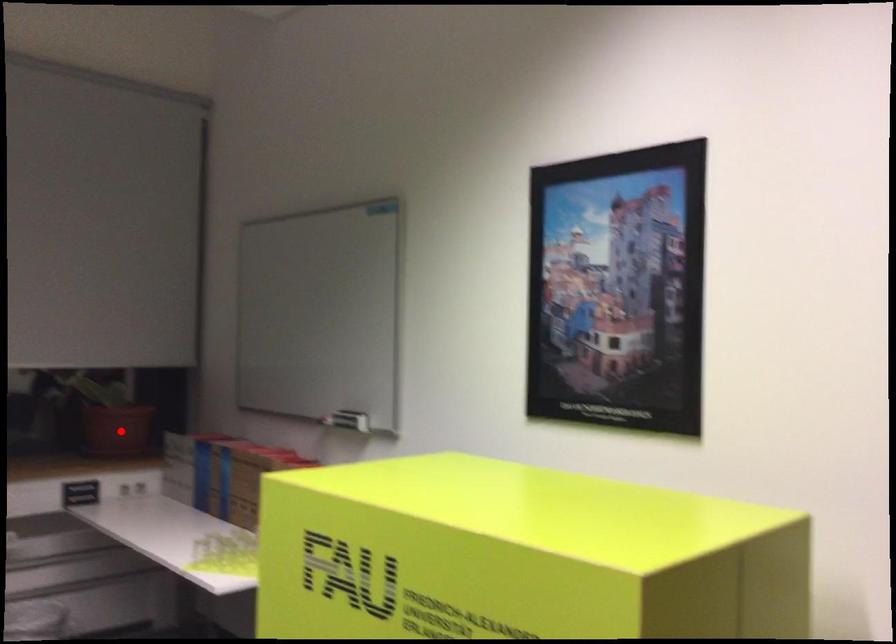
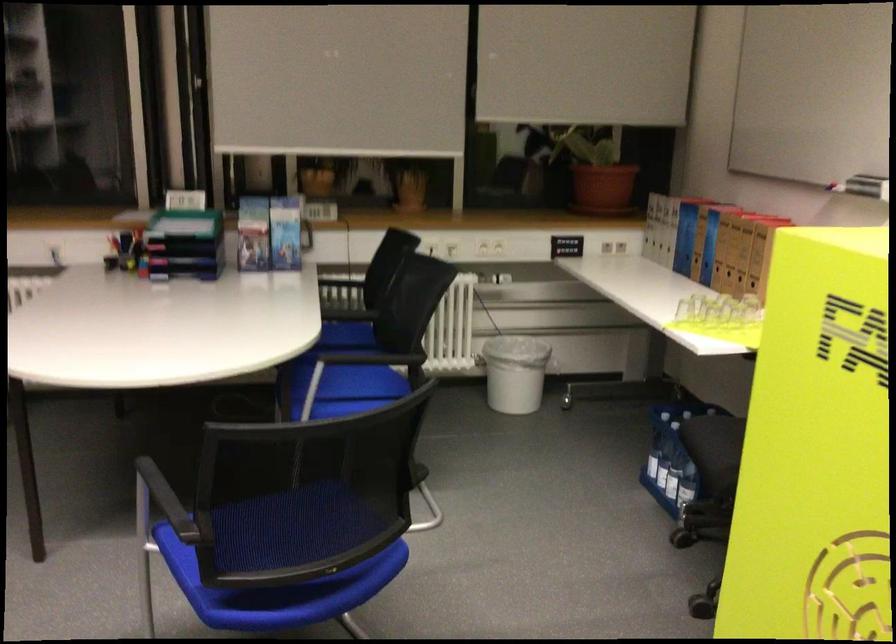
Question: I am providing you with two images of the same scene from different viewpoints. A red point is marked on the first image. Can you still see the location of the red point in image 2?

Choices:
 (A) Yes
 (B) No

Answer: (A)